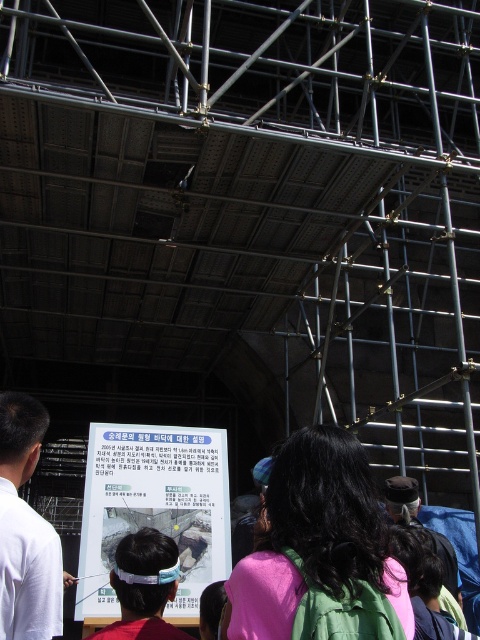
Consider the image. Does white matte shirt at lower left have a smaller size compared to light blue fabric headband at center?

Yes, white matte shirt at lower left is smaller than light blue fabric headband at center.

Between white matte shirt at lower left and light blue fabric headband at center, which one has more height?

white matte shirt at lower left is taller.

Who is more forward, (60, 589) or (152, 588)?

Point (60, 589) is more forward.

Where is `white matte shirt at lower left`? Image resolution: width=480 pixels, height=640 pixels. white matte shirt at lower left is located at coordinates (25, 529).

Which is more to the left, white paper at center or dark brown leather cap at center?

Positioned to the left is white paper at center.

Which is in front, point (193, 513) or point (448, 560)?

Positioned in front is point (193, 513).

I want to click on white paper at center, so click(x=154, y=508).

Find the location of a particular element. The width and height of the screenshot is (480, 640). white paper at center is located at coordinates (154, 508).

Is point (121, 573) positioned in front of point (395, 508)?

Yes, it is.

Does light blue fabric headband at center have a greater height compared to dark brown leather cap at center?

Indeed, light blue fabric headband at center has a greater height compared to dark brown leather cap at center.

This screenshot has height=640, width=480. I want to click on light blue fabric headband at center, so click(x=144, y=588).